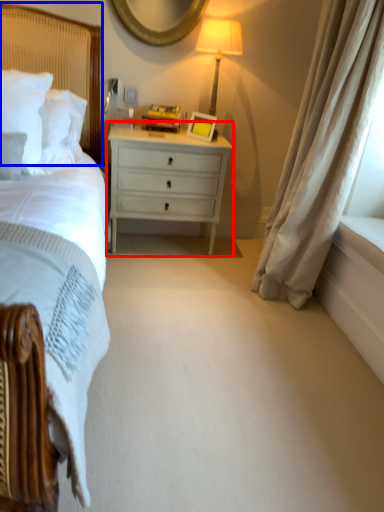
Question: Among these objects, which one is nearest to the camera, nightstand (highlighted by a red box) or headboard (highlighted by a blue box)?

Choices:
 (A) nightstand
 (B) headboard

Answer: (B)